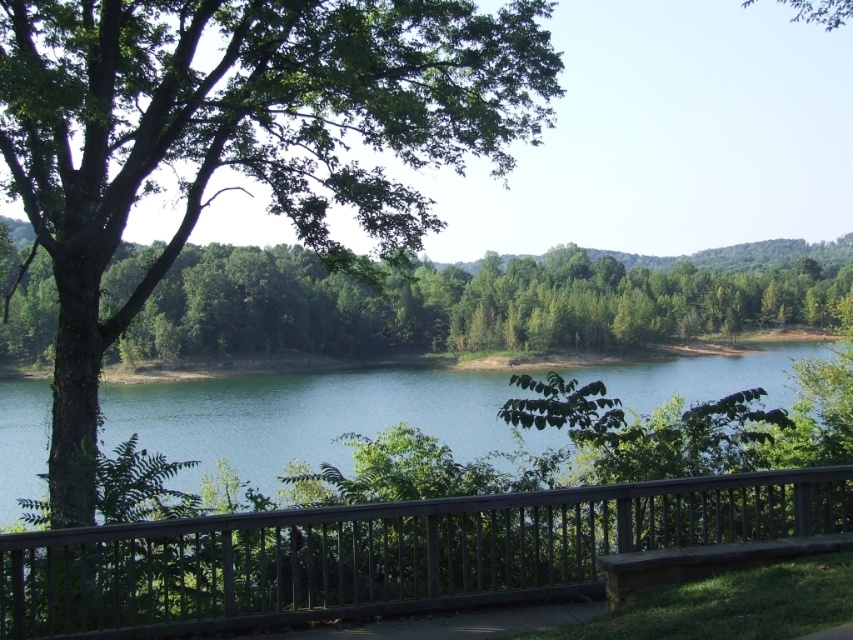
You are standing at the edge of the lakeside scene and want to find the dark brown wooden rail at center. According to the coordinates provided, where should you look to locate it?

The dark brown wooden rail at center is located at the 2D coordinates point (x=386, y=554).

You are a landscape architect designing a walking path that must pass between the dark brown wooden rail at center and the green leafy tree at center. The path needs to be at least 30 meters wide to accommodate large machinery. Can the path fit between them?

The dark brown wooden rail at center and green leafy tree at center are 31.70 meters apart from each other. Since the required width is 30 meters, the path can fit between them as the distance is sufficient.

You are standing on a deck overlooking a lake and see the dark brown wooden rail at center and the green leafy tree at center. Which object is closer to you?

The dark brown wooden rail at center is closer to you because it is positioned below the green leafy tree at center, indicating it is in front of the tree.